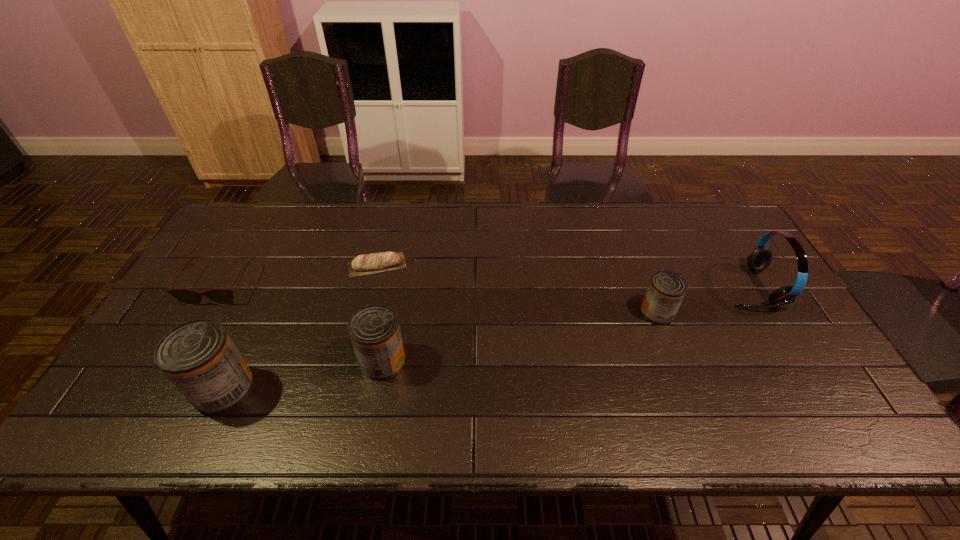
Find the location of `vacant space at the right edge of the desktop`. vacant space at the right edge of the desktop is located at coordinates (792, 357).

Identify the location of vacant space that is in between the shortest can and the headset. (704, 300).

Locate an element on the screen. vacant region between the shortest can and the rightmost object is located at coordinates (704, 300).

The width and height of the screenshot is (960, 540). What are the coordinates of `vacant space that's between the tallest can and the rightmost object` in the screenshot? It's located at (487, 339).

At what (x,y) coordinates should I click in order to perform the action: click on unoccupied area between the headset and the pita bread. Please return your answer as a coordinate pair (x, y). The height and width of the screenshot is (540, 960). Looking at the image, I should click on (564, 276).

I want to click on free area in between the pita bread and the fifth tallest object, so click(x=299, y=275).

The height and width of the screenshot is (540, 960). What are the coordinates of `free space between the shortest object and the leftmost can` in the screenshot? It's located at (300, 327).

The image size is (960, 540). I want to click on free space between the shortest object and the rightmost object, so click(564, 276).

The width and height of the screenshot is (960, 540). Identify the location of unoccupied position between the headset and the pita bread. (x=564, y=276).

You are a GUI agent. You are given a task and a screenshot of the screen. Output one action in this format:
    pyautogui.click(x=<x>, y=<y>)
    Task: Click on the object that ranks as the closest to the rightmost can
    This screenshot has height=540, width=960.
    Given the screenshot: What is the action you would take?
    pyautogui.click(x=760, y=257)